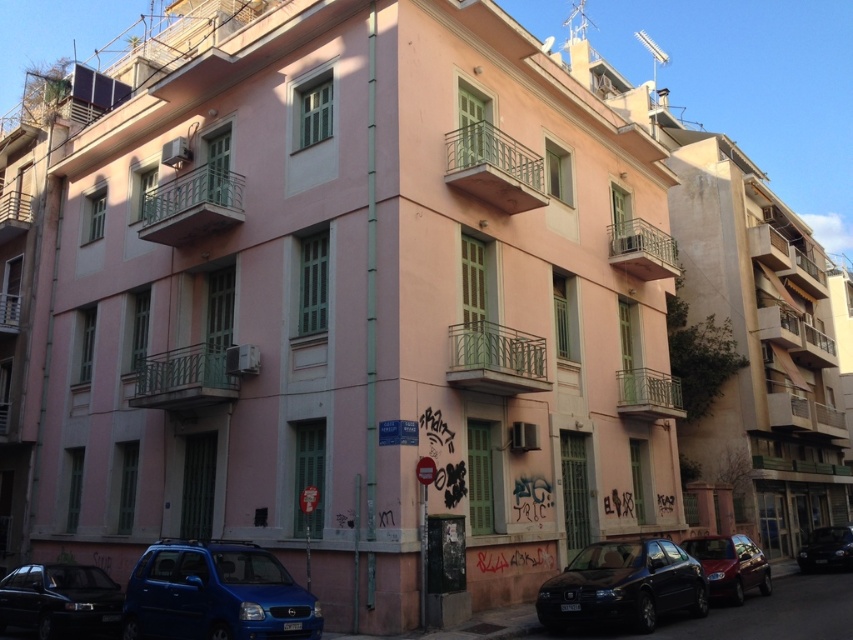
You are standing at the entrance of the building and want to reach a specific point marked at coordinates point [699,566]. If your maximum comfortable walking distance is 15 meters, can you comfortably reach that point without straining?

The distance of point [699,566] from camera is 15.09 meters, which is slightly beyond your maximum comfortable walking distance of 15 meters. Therefore, reaching that point might require a bit of extra effort or a short walk.

In the scene shown: You are a delivery person standing on the sidewalk in front of the building. You need to deliver a package to the apartment above the shiny dark blue sedan at lower center. The balcony where the package should be left is the metallic silver balcony at upper center. Can you confirm if the balcony is directly above the sedan?

The shiny dark blue sedan at lower center is closer to the viewer than the metallic silver balcony at upper center, which means the balcony is indeed positioned above the sedan. Therefore, the metallic silver balcony at upper center is directly above the shiny dark blue sedan at lower center.